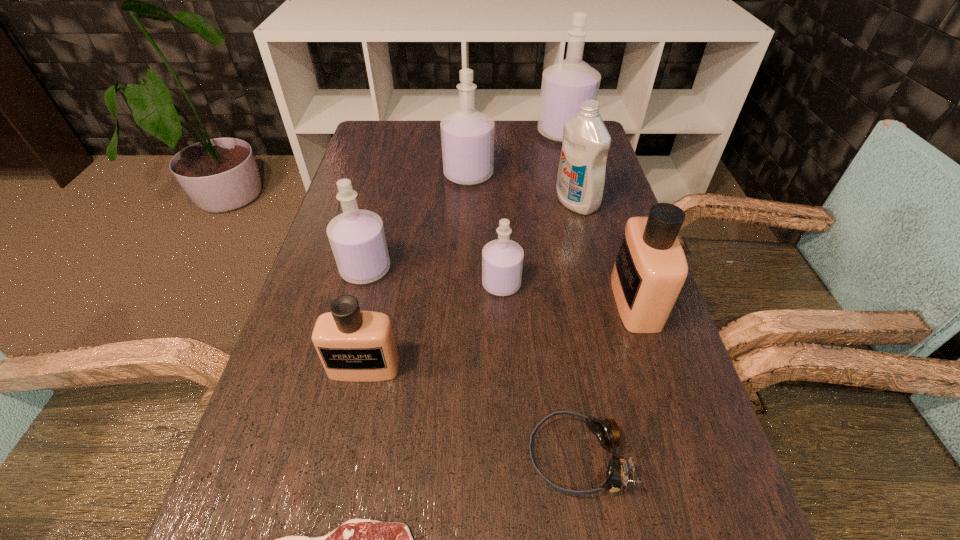
Find the location of a particular element. The width and height of the screenshot is (960, 540). the left beige perfume is located at coordinates click(354, 346).

Where is `bronze goggles`? The image size is (960, 540). bronze goggles is located at coordinates (606, 431).

Identify the location of the second shortest object. (606, 431).

Locate an element on the screen. vacant position located 0.340m on the left of the farthest object is located at coordinates (435, 133).

The image size is (960, 540). What are the coordinates of `vacant space located on the right of the fifth shortest perfume` in the screenshot? It's located at (568, 174).

Find the location of `free spot located 0.370m on the left of the white detergent`. free spot located 0.370m on the left of the white detergent is located at coordinates (420, 202).

Locate an element on the screen. The height and width of the screenshot is (540, 960). free space located on the front of the second smallest purple perfume is located at coordinates (327, 419).

You are a GUI agent. You are given a task and a screenshot of the screen. Output one action in this format:
    pyautogui.click(x=<x>, y=<y>)
    Task: Click on the free space located on the front label of the bigger beige perfume
    
    Given the screenshot: What is the action you would take?
    (522, 301)

Locate an element on the screen. The image size is (960, 540). free space located 0.250m on the front label of the bigger beige perfume is located at coordinates (499, 301).

At what (x,y) coordinates should I click in order to perform the action: click on vacant region located 0.320m on the front label of the bigger beige perfume. Please return your answer as a coordinate pair (x, y). Looking at the image, I should click on (467, 301).